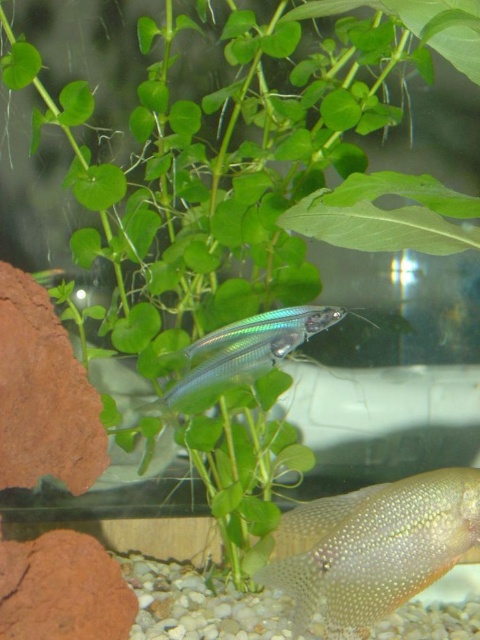
Is translucent glass fish at center wider than transparent glass fish at center?

No, translucent glass fish at center is not wider than transparent glass fish at center.

In the scene shown: Which of these two, translucent glass fish at center or transparent glass fish at center, stands shorter?

With less height is transparent glass fish at center.

Measure the distance between translucent glass fish at center and camera.

translucent glass fish at center is 1.07 meters from camera.

You are a GUI agent. You are given a task and a screenshot of the screen. Output one action in this format:
    pyautogui.click(x=<x>, y=<y>)
    Task: Click on the translucent glass fish at center
    The height and width of the screenshot is (640, 480).
    Given the screenshot: What is the action you would take?
    pyautogui.click(x=374, y=547)